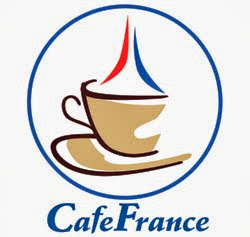
Where is `saucer`? The width and height of the screenshot is (250, 237). saucer is located at coordinates (100, 164).